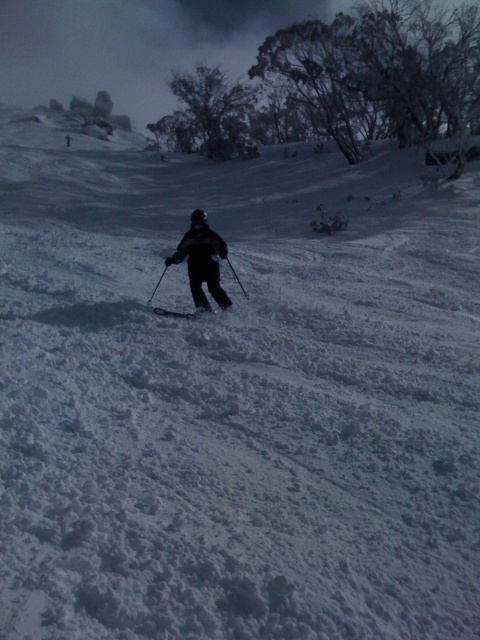
Consider the image. You are a photographer trying to capture the skier in the snowy landscape. You want to ensure the dark gray ski suit at center and the matte black ski at center are both visible in your shot. Which object should you focus on to ensure both are in frame?

The dark gray ski suit at center has a greater height compared to the matte black ski at center. To ensure both are in frame, focus on the taller object, the dark gray ski suit at center, as it will naturally include the shorter matte black ski at center within the shot.

You are a photographer trying to capture the dark gray ski suit at center and the matte black ski at center in a single shot. Which object should you focus on first if you want both to be in clear view?

The dark gray ski suit at center is positioned on the left side of matte black ski at center, so you should focus on the matte black ski at center first as it is closer to the right side and will ensure both objects are in clear view.